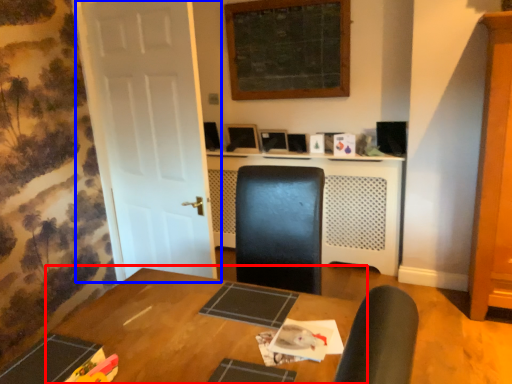
Question: Which object appears closest to the camera in this image, table (highlighted by a red box) or door (highlighted by a blue box)?

Choices:
 (A) table
 (B) door

Answer: (A)